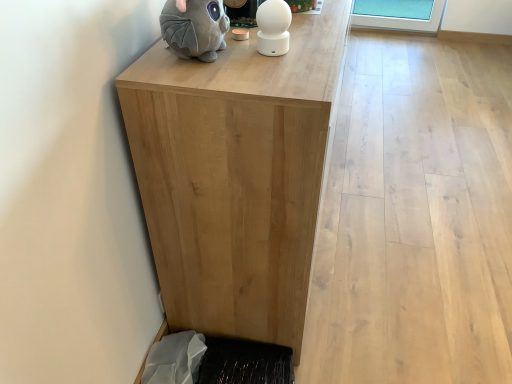
The width and height of the screenshot is (512, 384). What are the coordinates of `free location to the right of white glossy ball at upper center` in the screenshot? It's located at (322, 46).